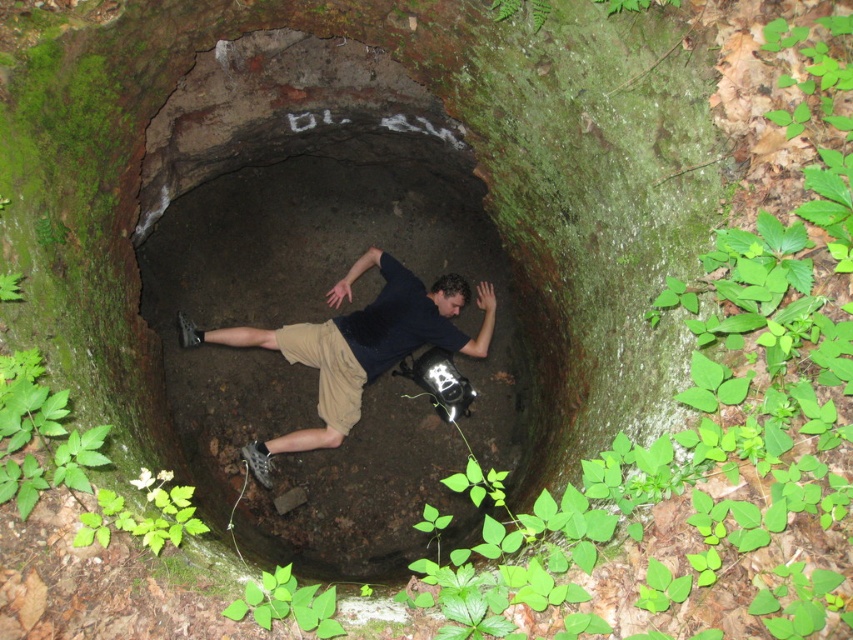
You are a hiker who has just discovered a brown dirt cave at center and noticed your khaki cotton shorts at center. Based on the scene, which object is taller?

The brown dirt cave at center is much taller than the khaki cotton shorts at center.

You are a hiker who has just discovered this well. You notice the black matte shirt at center and the khaki cotton shorts at center. Which item takes up more space in the well?

The black matte shirt at center is larger in size than khaki cotton shorts at center, so the black matte shirt at center takes up more space in the well.

You are a hiker who has just found a well in the forest. You see the brown dirt cave at center and the khaki cotton shorts at center. Which object is positioned to the right of the other?

The brown dirt cave at center is to the right of the khaki cotton shorts at center.